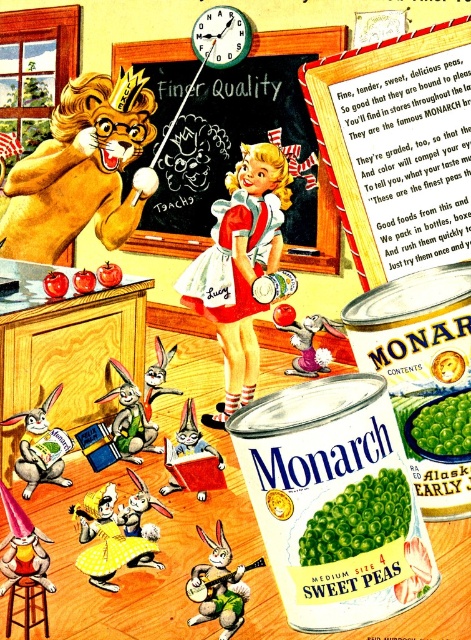
You are standing in the classroom depicted in the image. Where is the green matte sweet peas at center positioned relative to the other elements in the scene?

The green matte sweet peas at center is located at point (357,518) in the scene.

You are a student in the classroom shown. You want to place a 2.5 feet long ruler between the golden fur lion at upper left and the white fur rabbit at lower left. Will the ruler fit between them?

The golden fur lion at upper left and white fur rabbit at lower left are 3.44 feet apart. Since the ruler is 2.5 feet long, it will fit between them with some space to spare.